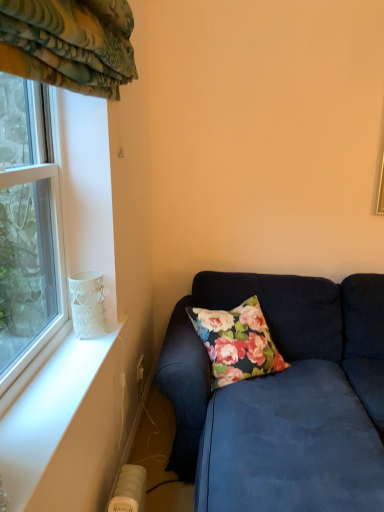
Question: From a real-world perspective, is clear glass window at left under white lace glass at window?

Choices:
 (A) no
 (B) yes

Answer: (A)

Question: Is the position of clear glass window at left less distant than that of white lace glass at window?

Choices:
 (A) yes
 (B) no

Answer: (A)

Question: Is clear glass window at left facing away from white lace glass at window?

Choices:
 (A) yes
 (B) no

Answer: (B)

Question: Does clear glass window at left have a lesser height compared to white lace glass at window?

Choices:
 (A) yes
 (B) no

Answer: (B)

Question: Considering the relative sizes of clear glass window at left and white lace glass at window in the image provided, is clear glass window at left thinner than white lace glass at window?

Choices:
 (A) no
 (B) yes

Answer: (A)

Question: Is white lace glass at window bigger or smaller than velvet blue couch at lower right?

Choices:
 (A) small
 (B) big

Answer: (A)

Question: From a real-world perspective, is white lace glass at window above or below velvet blue couch at lower right?

Choices:
 (A) below
 (B) above

Answer: (B)

Question: Is point (91, 272) closer or farther from the camera than point (236, 479)?

Choices:
 (A) closer
 (B) farther

Answer: (B)

Question: In terms of width, does white lace glass at window look wider or thinner when compared to velvet blue couch at lower right?

Choices:
 (A) thin
 (B) wide

Answer: (A)

Question: Is point (49, 317) positioned closer to the camera than point (104, 331)?

Choices:
 (A) farther
 (B) closer

Answer: (A)

Question: Visually, is clear glass window at left positioned to the left or to the right of white lace glass at window?

Choices:
 (A) left
 (B) right

Answer: (A)

Question: In the image, is clear glass window at left positioned in front of or behind white lace glass at window?

Choices:
 (A) behind
 (B) front

Answer: (B)

Question: Is clear glass window at left inside the boundaries of white lace glass at window, or outside?

Choices:
 (A) outside
 (B) inside

Answer: (A)

Question: From the image's perspective, is velvet blue couch at lower right above or below white lace glass at window?

Choices:
 (A) above
 (B) below

Answer: (B)

Question: Which is correct: velvet blue couch at lower right is inside white lace glass at window, or outside of it?

Choices:
 (A) outside
 (B) inside

Answer: (A)